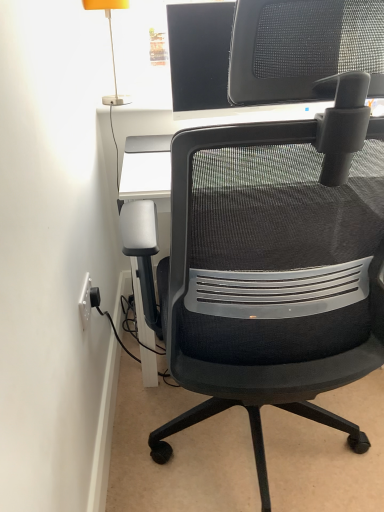
Measure the distance between black mesh office chair at center and camera.

black mesh office chair at center and camera are 20.79 inches apart.

Describe the element at coordinates (273, 269) in the screenshot. I see `black mesh office chair at center` at that location.

Where is `black mesh office chair at center`? The width and height of the screenshot is (384, 512). black mesh office chair at center is located at coordinates (273, 269).

This screenshot has height=512, width=384. Describe the element at coordinates (111, 42) in the screenshot. I see `orange fabric lampshade at upper left` at that location.

The height and width of the screenshot is (512, 384). Identify the location of orange fabric lampshade at upper left. (111, 42).

Where is `black mesh office chair at center`? The image size is (384, 512). black mesh office chair at center is located at coordinates pos(273,269).

Which is more to the left, orange fabric lampshade at upper left or black mesh office chair at center?

From the viewer's perspective, orange fabric lampshade at upper left appears more on the left side.

Between orange fabric lampshade at upper left and black mesh office chair at center, which one is positioned in front?

black mesh office chair at center is more forward.

Is point (115, 1) positioned behind point (152, 254)?

Yes, point (115, 1) is behind point (152, 254).

From the image's perspective, which object appears higher, orange fabric lampshade at upper left or black mesh office chair at center?

orange fabric lampshade at upper left.

From a real-world perspective, is orange fabric lampshade at upper left located beneath black mesh office chair at center?

Incorrect, from a real-world perspective, orange fabric lampshade at upper left is higher than black mesh office chair at center.

Is orange fabric lampshade at upper left wider than black mesh office chair at center?

No, orange fabric lampshade at upper left is not wider than black mesh office chair at center.

Is orange fabric lampshade at upper left taller or shorter than black mesh office chair at center?

Clearly, orange fabric lampshade at upper left is shorter compared to black mesh office chair at center.

Is orange fabric lampshade at upper left bigger or smaller than black mesh office chair at center?

Clearly, orange fabric lampshade at upper left is smaller in size than black mesh office chair at center.

Is black mesh office chair at center located within orange fabric lampshade at upper left?

No, black mesh office chair at center is not a part of orange fabric lampshade at upper left.

Is the surface of orange fabric lampshade at upper left in direct contact with black mesh office chair at center?

orange fabric lampshade at upper left and black mesh office chair at center are not in contact.

Is orange fabric lampshade at upper left looking in the opposite direction of black mesh office chair at center?

No, orange fabric lampshade at upper left is not facing the opposite direction of black mesh office chair at center.

How different are the orientations of orange fabric lampshade at upper left and black mesh office chair at center in degrees?

178 degrees separate the facing orientations of orange fabric lampshade at upper left and black mesh office chair at center.

The height and width of the screenshot is (512, 384). I want to click on table lamp above the black mesh office chair at center (from a real-world perspective), so tap(111, 42).

Considering the relative positions of black mesh office chair at center and orange fabric lampshade at upper left in the image provided, is black mesh office chair at center to the right of orange fabric lampshade at upper left from the viewer's perspective?

Yes.

Is black mesh office chair at center further to the viewer compared to orange fabric lampshade at upper left?

No, it is in front of orange fabric lampshade at upper left.

Is point (232, 302) farther from viewer compared to point (117, 99)?

No, it is in front of (117, 99).

From the image's perspective, would you say black mesh office chair at center is shown under orange fabric lampshade at upper left?

Indeed, from the image's perspective, black mesh office chair at center is shown beneath orange fabric lampshade at upper left.

From a real-world perspective, which is physically below, black mesh office chair at center or orange fabric lampshade at upper left?

black mesh office chair at center.

Does black mesh office chair at center have a greater width compared to orange fabric lampshade at upper left?

Correct, the width of black mesh office chair at center exceeds that of orange fabric lampshade at upper left.

Between black mesh office chair at center and orange fabric lampshade at upper left, which one has less height?

orange fabric lampshade at upper left.

Considering the sizes of objects black mesh office chair at center and orange fabric lampshade at upper left in the image provided, who is smaller, black mesh office chair at center or orange fabric lampshade at upper left?

With smaller size is orange fabric lampshade at upper left.

From the picture: Is black mesh office chair at center completely or partially outside of orange fabric lampshade at upper left?

black mesh office chair at center lies outside orange fabric lampshade at upper left's area.

Are black mesh office chair at center and orange fabric lampshade at upper left located far from each other?

That's right, there is a large distance between black mesh office chair at center and orange fabric lampshade at upper left.

Consider the image. Is black mesh office chair at center oriented towards orange fabric lampshade at upper left?

Yes, black mesh office chair at center is facing orange fabric lampshade at upper left.

Can you tell me how much black mesh office chair at center and orange fabric lampshade at upper left differ in facing direction?

178 degrees.

Locate an element on the screen. chair below the orange fabric lampshade at upper left (from a real-world perspective) is located at coordinates (273, 269).

Where is `table lamp on the left of black mesh office chair at center`? table lamp on the left of black mesh office chair at center is located at coordinates (111, 42).

You are a GUI agent. You are given a task and a screenshot of the screen. Output one action in this format:
    pyautogui.click(x=<x>, y=<y>)
    Task: Click on the chair lying on the right of orange fabric lampshade at upper left
    This screenshot has width=384, height=512.
    Given the screenshot: What is the action you would take?
    pyautogui.click(x=273, y=269)